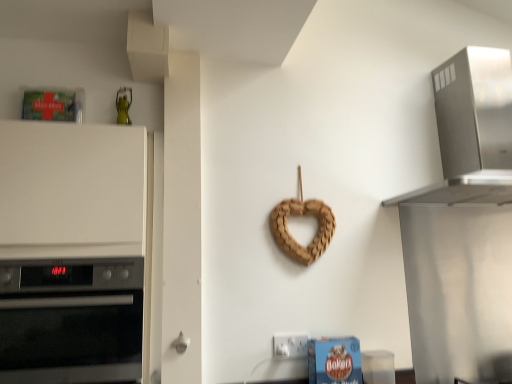
In order to click on white plastic door handle at lower center in this screenshot , I will do `click(180, 343)`.

Where is `stainless steel range hood at upper right`? Image resolution: width=512 pixels, height=384 pixels. stainless steel range hood at upper right is located at coordinates pyautogui.click(x=472, y=130).

At what (x,y) coordinates should I click in order to perform the action: click on braided wood heart at center. Please return your answer as a coordinate pair (x, y). The image size is (512, 384). Looking at the image, I should click on (291, 235).

This screenshot has height=384, width=512. What do you see at coordinates (71, 320) in the screenshot?
I see `black glass oven at left` at bounding box center [71, 320].

Where is `white plastic door handle at lower center`? white plastic door handle at lower center is located at coordinates pyautogui.click(x=180, y=343).

Is white plastic electric outlet at lower center inside or outside of braided wood heart at center?

The correct answer is: outside.

From the image's perspective, is white plastic electric outlet at lower center located beneath braided wood heart at center?

Yes.

Does point (285, 347) lie in front of point (298, 213)?

Yes, point (285, 347) is closer to viewer.

Is white plastic electric outlet at lower center at the left side of braided wood heart at center?

Indeed, white plastic electric outlet at lower center is positioned on the left side of braided wood heart at center.

Between white matte oven at left and white plastic door handle at lower center, which one is positioned in front?

white matte oven at left is more forward.

Considering the sizes of white matte oven at left and white plastic door handle at lower center in the image, is white matte oven at left wider or thinner than white plastic door handle at lower center?

white matte oven at left is wider than white plastic door handle at lower center.

Is white matte oven at left far away from white plastic door handle at lower center?

white matte oven at left is actually quite close to white plastic door handle at lower center.

From a real-world perspective, who is located lower, white matte oven at left or white plastic door handle at lower center?

white plastic door handle at lower center.

Which object is further away from the camera, stainless steel range hood at upper right or white plastic electric outlet at lower center?

Positioned behind is white plastic electric outlet at lower center.

From the picture: Can you tell me how much stainless steel range hood at upper right and white plastic electric outlet at lower center differ in facing direction?

stainless steel range hood at upper right and white plastic electric outlet at lower center are facing 0.0479 degrees away from each other.

Considering the relative sizes of stainless steel range hood at upper right and white plastic electric outlet at lower center in the image provided, is stainless steel range hood at upper right shorter than white plastic electric outlet at lower center?

In fact, stainless steel range hood at upper right may be taller than white plastic electric outlet at lower center.

Looking at their sizes, would you say stainless steel range hood at upper right is wider or thinner than white plastic electric outlet at lower center?

Considering their sizes, stainless steel range hood at upper right looks broader than white plastic electric outlet at lower center.

In the image, is braided wood heart at center on the left side or the right side of white matte oven at left?

In the image, braided wood heart at center appears on the right side of white matte oven at left.

From a real-world perspective, relative to white matte oven at left, is braided wood heart at center vertically above or below?

braided wood heart at center is situated higher than white matte oven at left in the real world.

Considering the points (304, 262) and (64, 244), which point is in front, point (304, 262) or point (64, 244)?

Point (64, 244)

Which of these two, stainless steel range hood at upper right or braided wood heart at center, stands shorter?

Standing shorter between the two is braided wood heart at center.

Find the location of a particular element. home appliance in front of the braided wood heart at center is located at coordinates (472, 130).

Is stainless steel range hood at upper right not near braided wood heart at center?

That's not correct — stainless steel range hood at upper right is a little close to braided wood heart at center.

Is black glass oven at left inside the boundaries of braided wood heart at center, or outside?

The correct answer is: outside.

Considering the positions of objects black glass oven at left and braided wood heart at center in the image provided, who is more to the right, black glass oven at left or braided wood heart at center?

From the viewer's perspective, braided wood heart at center appears more on the right side.

Is black glass oven at left shorter than braided wood heart at center?

No.

Is white matte oven at left looking in the opposite direction of braided wood heart at center?

white matte oven at left does not have its back to braided wood heart at center.

From a real-world perspective, which is physically above, white matte oven at left or braided wood heart at center?

In real-world perspective, braided wood heart at center is above.

Does white matte oven at left have a smaller size compared to braided wood heart at center?

No.

Which is less distant, [68,240] or [313,210]?

The point [68,240] is more forward.

Where is `pretzel lying behind the white plastic electric outlet at lower center`? pretzel lying behind the white plastic electric outlet at lower center is located at coordinates (291, 235).

At what (x,y) coordinates should I click in order to perform the action: click on door handle on the right of white matte oven at left. Please return your answer as a coordinate pair (x, y). Looking at the image, I should click on (180, 343).

Looking at the image, which one is located closer to braided wood heart at center, black glass oven at left or white matte oven at left?

Among the two, white matte oven at left is located nearer to braided wood heart at center.

Looking at the image, which one is located further to white matte oven at left, black glass oven at left or white plastic electric outlet at lower center?

white plastic electric outlet at lower center lies further to white matte oven at left than the other object.

When comparing their distances from black glass oven at left, does stainless steel range hood at upper right or braided wood heart at center seem closer?

Among the two, braided wood heart at center is located nearer to black glass oven at left.

Considering their positions, is white matte oven at left positioned further to black glass oven at left than white plastic electric outlet at lower center?

Among the two, white plastic electric outlet at lower center is located further to black glass oven at left.

Estimate the real-world distances between objects in this image. Which object is further from stainless steel range hood at upper right, white plastic door handle at lower center or braided wood heart at center?

The object further to stainless steel range hood at upper right is white plastic door handle at lower center.

Estimate the real-world distances between objects in this image. Which object is closer to braided wood heart at center, stainless steel range hood at upper right or black glass oven at left?

stainless steel range hood at upper right is positioned closer to the anchor braided wood heart at center.

Consider the image. From the image, which object appears to be farther from white matte oven at left, stainless steel range hood at upper right or white plastic door handle at lower center?

stainless steel range hood at upper right.

Considering their positions, is white matte oven at left positioned further to stainless steel range hood at upper right than white plastic door handle at lower center?

white plastic door handle at lower center is positioned further to the anchor stainless steel range hood at upper right.

This screenshot has height=384, width=512. Identify the location of pretzel located between white plastic electric outlet at lower center and stainless steel range hood at upper right in the left-right direction. (291, 235).

Where is `electric outlet situated between black glass oven at left and braided wood heart at center from left to right`? The image size is (512, 384). electric outlet situated between black glass oven at left and braided wood heart at center from left to right is located at coordinates (290, 345).

Where is `pretzel between white plastic door handle at lower center and stainless steel range hood at upper right in the horizontal direction`? pretzel between white plastic door handle at lower center and stainless steel range hood at upper right in the horizontal direction is located at coordinates (291, 235).

This screenshot has height=384, width=512. Find the location of `door handle between white matte oven at left and stainless steel range hood at upper right in the horizontal direction`. door handle between white matte oven at left and stainless steel range hood at upper right in the horizontal direction is located at coordinates (180, 343).